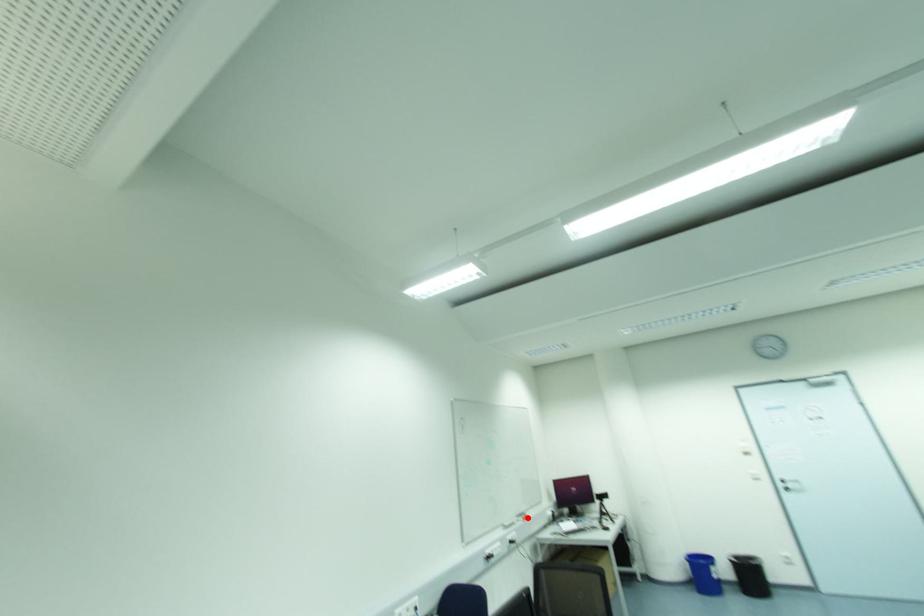
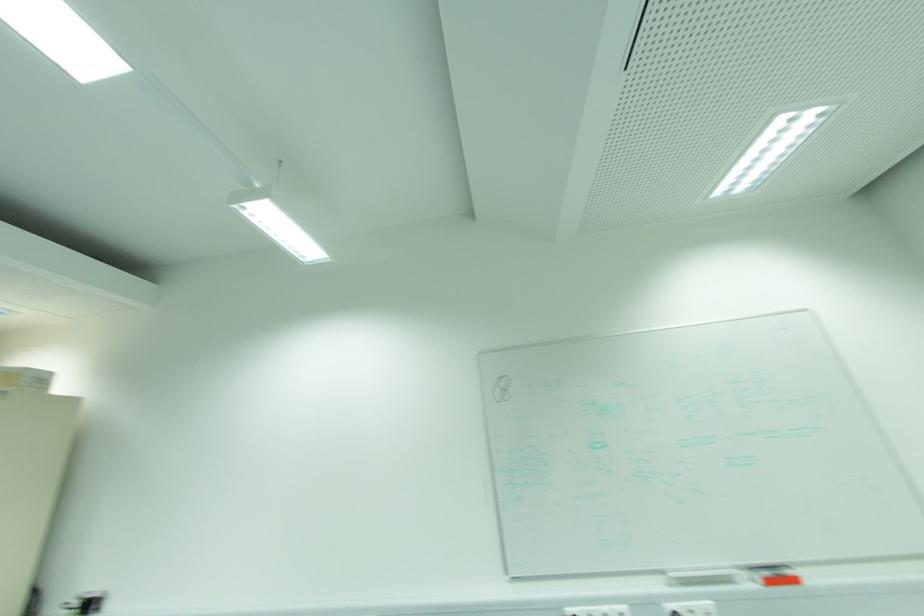
Question: I am providing you with two images of the same scene from different viewpoints. Image1 has a red point marked. In image2, the corresponding 3D location appears at what relative position? Reply with the corresponding letter.

Choices:
 (A) Closer
 (B) Farther

Answer: (A)